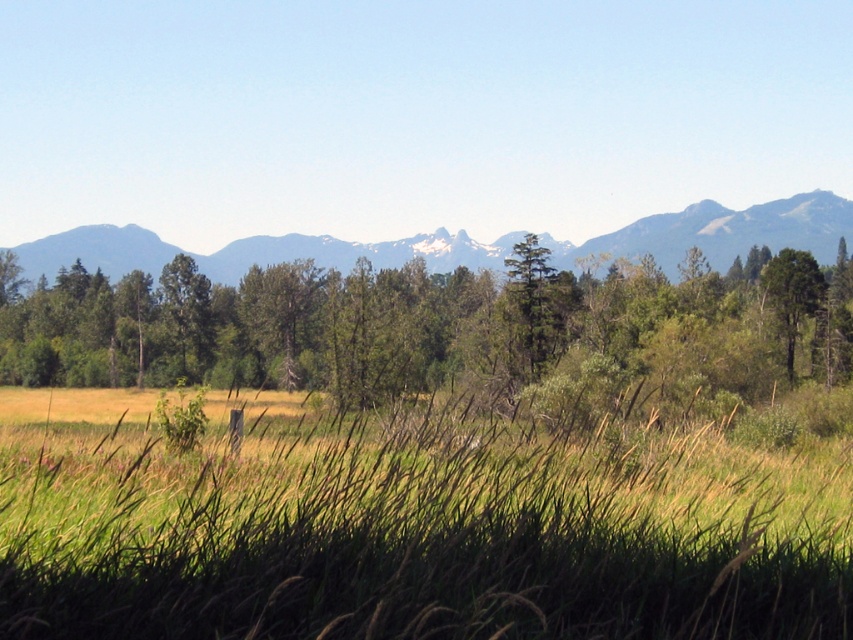
Question: Which object is closer to the camera taking this photo?

Choices:
 (A) green grassy at center
 (B) green leafy tree at center
 (C) green textured tree at center
 (D) snow-capped mountains at upper center

Answer: (A)

Question: Is green grassy at center further to the viewer compared to green textured tree at center?

Choices:
 (A) no
 (B) yes

Answer: (A)

Question: Does green leafy tree at center lie in front of snow-capped mountains at upper center?

Choices:
 (A) yes
 (B) no

Answer: (A)

Question: Which object is closer to the camera taking this photo?

Choices:
 (A) snow-capped mountains at upper center
 (B) green grassy at center
 (C) green leafy tree at center

Answer: (B)

Question: Can you confirm if green leafy tree at center is positioned to the right of snow-capped mountains at upper center?

Choices:
 (A) yes
 (B) no

Answer: (B)

Question: Among these objects, which one is farthest from the camera?

Choices:
 (A) green grassy at center
 (B) green textured tree at center

Answer: (B)